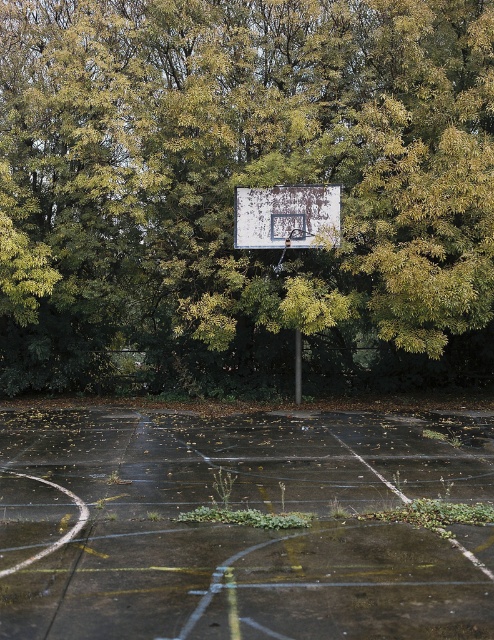
Which is above, concrete court at center or white painted metal basketball backboard at center?

white painted metal basketball backboard at center is higher up.

Is concrete court at center bigger than white painted metal basketball backboard at center?

Yes, concrete court at center is bigger than white painted metal basketball backboard at center.

Is point (484, 499) closer to camera compared to point (307, 184)?

Yes.

Where is `concrete court at center`? The image size is (494, 640). concrete court at center is located at coordinates (241, 525).

Is green leafy tree at upper center above white painted metal basketball backboard at center?

Indeed, green leafy tree at upper center is positioned over white painted metal basketball backboard at center.

Does green leafy tree at upper center come behind white painted metal basketball backboard at center?

No.

Which is behind, point (278, 8) or point (314, 225)?

The point (278, 8) is behind.

Where is `green leafy tree at upper center`? green leafy tree at upper center is located at coordinates (246, 186).

Can you confirm if green leafy tree at upper center is positioned to the right of concrete court at center?

No, green leafy tree at upper center is not to the right of concrete court at center.

Which is more to the left, green leafy tree at upper center or concrete court at center?

green leafy tree at upper center is more to the left.

Is point (394, 1) positioned after point (313, 513)?

Yes, point (394, 1) is farther from viewer.

In order to click on green leafy tree at upper center in this screenshot , I will do `click(246, 186)`.